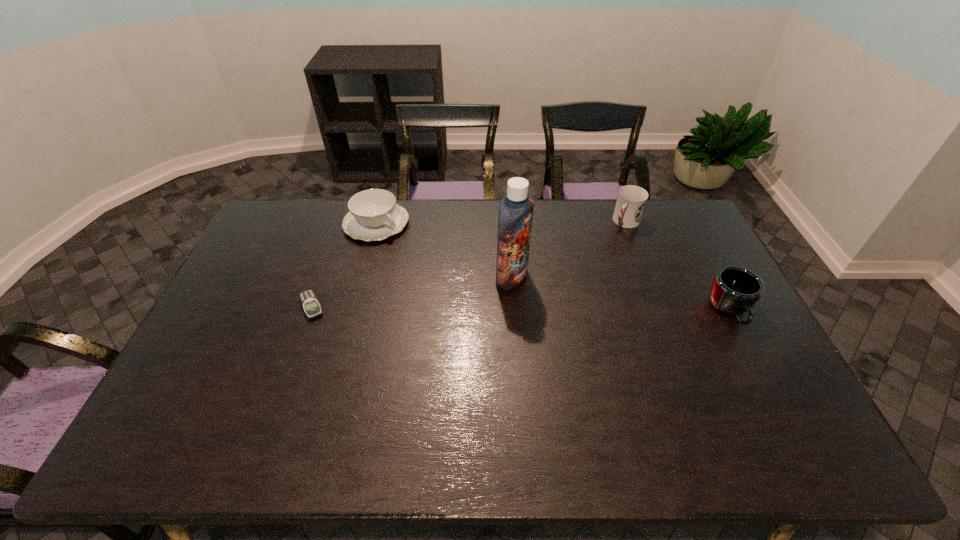
Image resolution: width=960 pixels, height=540 pixels. I want to click on vacant area located 0.100m on the handle side of the chinaware, so click(414, 252).

Identify the location of vacant region located 0.330m on the front label of the third object from right to left. The height and width of the screenshot is (540, 960). (624, 332).

Find the location of a particular element. The width and height of the screenshot is (960, 540). free spot located 0.210m on the front label of the third object from right to left is located at coordinates (587, 314).

Where is `free space located on the front label of the third object from right to left`? free space located on the front label of the third object from right to left is located at coordinates (565, 305).

Identify the location of blank area located on the handle side of the second object from right to left. [579, 283].

Image resolution: width=960 pixels, height=540 pixels. I want to click on vacant space located 0.310m on the handle side of the second object from right to left, so click(x=582, y=280).

The width and height of the screenshot is (960, 540). What are the coordinates of `vacant space situated 0.260m on the handle side of the second object from right to left` in the screenshot? It's located at (588, 271).

Where is `chinaware present at the far edge`? Image resolution: width=960 pixels, height=540 pixels. chinaware present at the far edge is located at coordinates (374, 214).

Locate an element on the screen. This screenshot has height=540, width=960. cup that is at the far edge is located at coordinates (631, 201).

I want to click on object present at the right edge, so click(x=734, y=290).